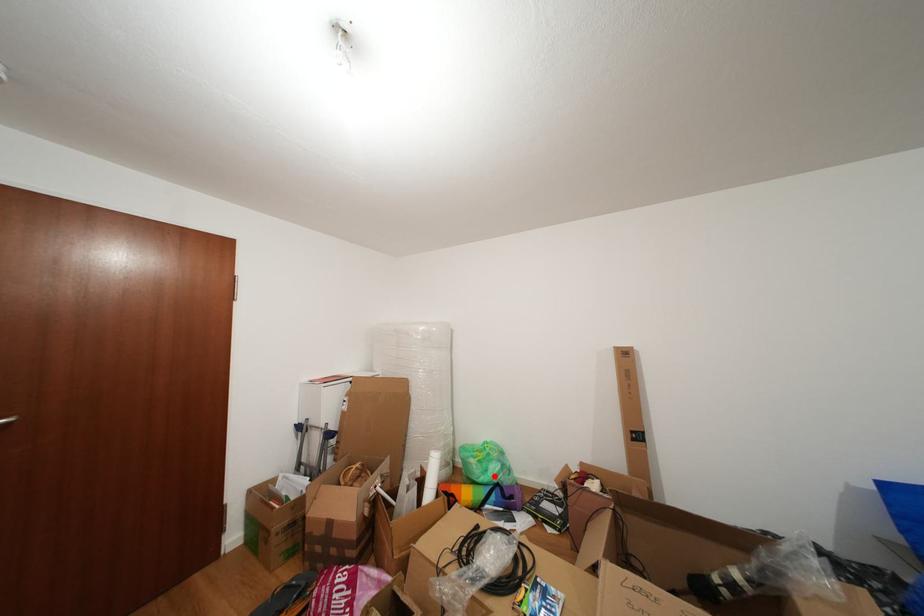
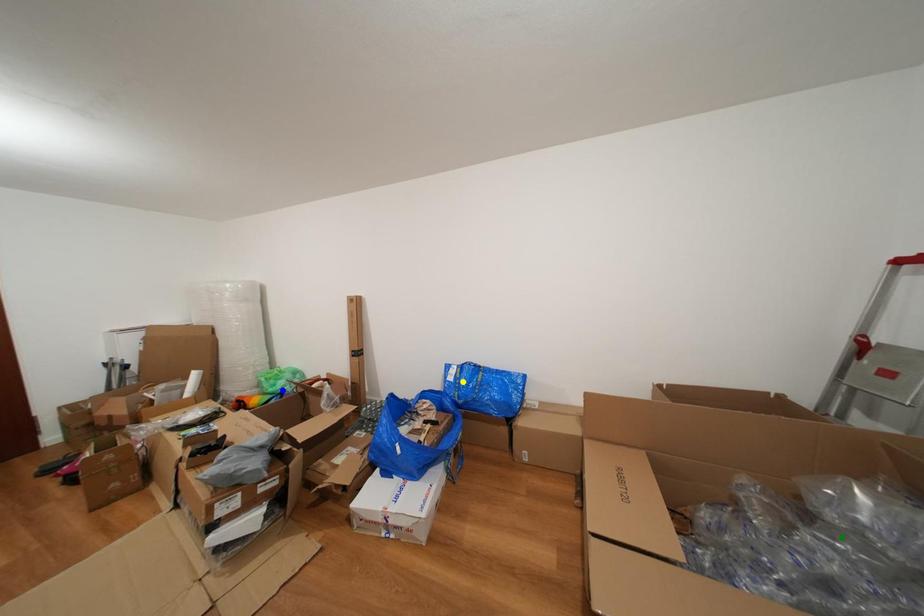
Question: I am providing you with two images of the same scene from different viewpoints. A red point is marked on the first image. You are given multiple points on the second image. Can you choose the point in image 2 that corresponds to the point in image 1?

Choices:
 (A) blue point
 (B) yellow point
 (C) green point

Answer: (A)